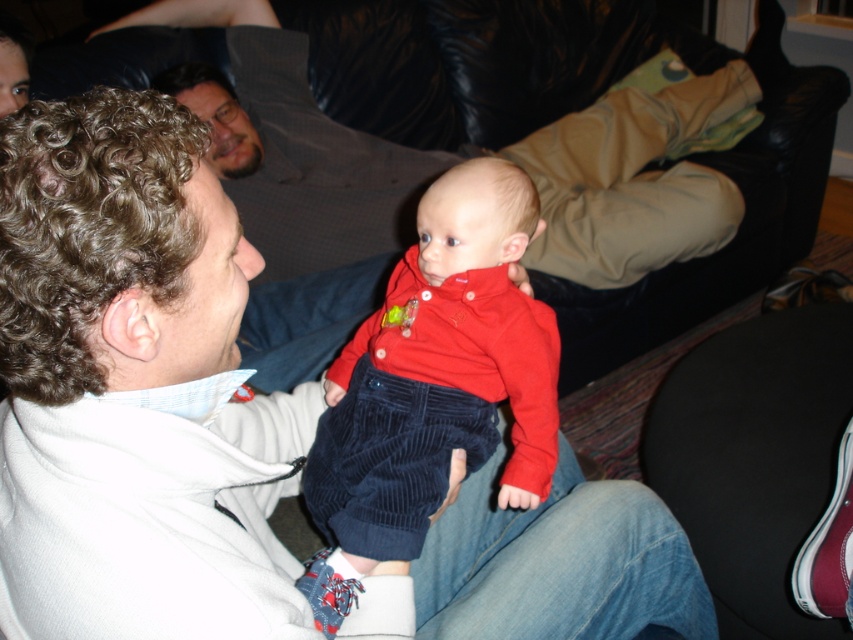
Is point (531, 435) in front of point (833, 317)?

That is True.

Is point (431, 461) less distant than point (838, 333)?

Yes.

In order to click on velvet corduroy pants at center in this screenshot , I will do `click(438, 374)`.

Is white fleece jacket at center below maroon suede shoe at lower right?

No, white fleece jacket at center is not below maroon suede shoe at lower right.

This screenshot has width=853, height=640. Identify the location of white fleece jacket at center. (132, 387).

In order to click on white fleece jacket at center in this screenshot , I will do tap(132, 387).

How much distance is there between white fleece jacket at center and velvet corduroy pants at center?

They are 6.13 inches apart.

Is point (22, 595) less distant than point (433, 323)?

Yes, it is in front of point (433, 323).

I want to click on white fleece jacket at center, so click(x=132, y=387).